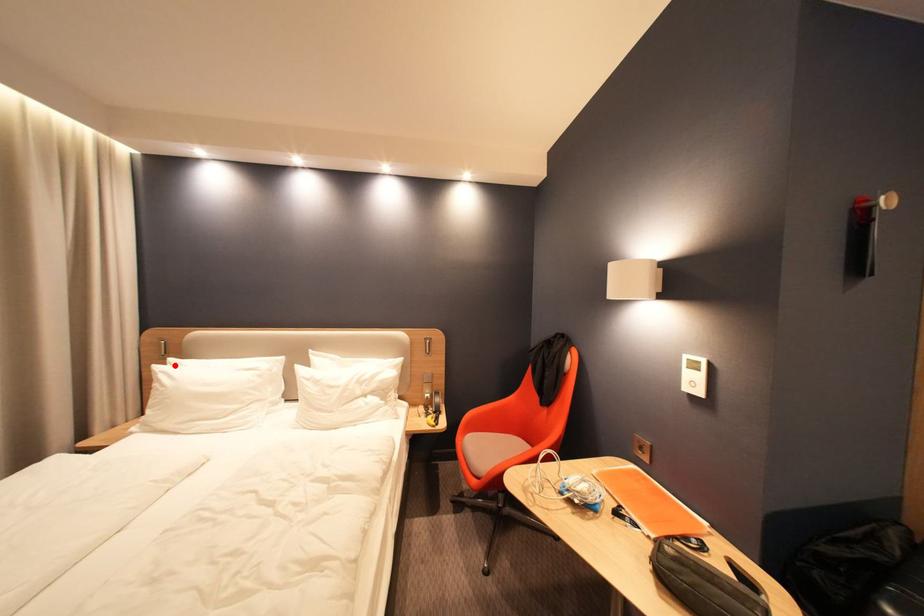
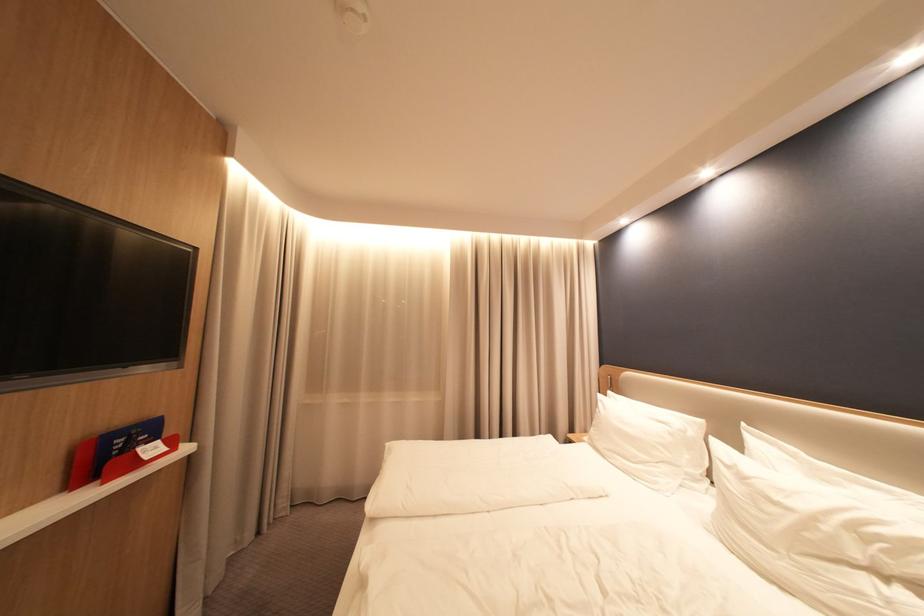
Find the pixel in the second image that matches the highlighted location in the first image.

(615, 397)